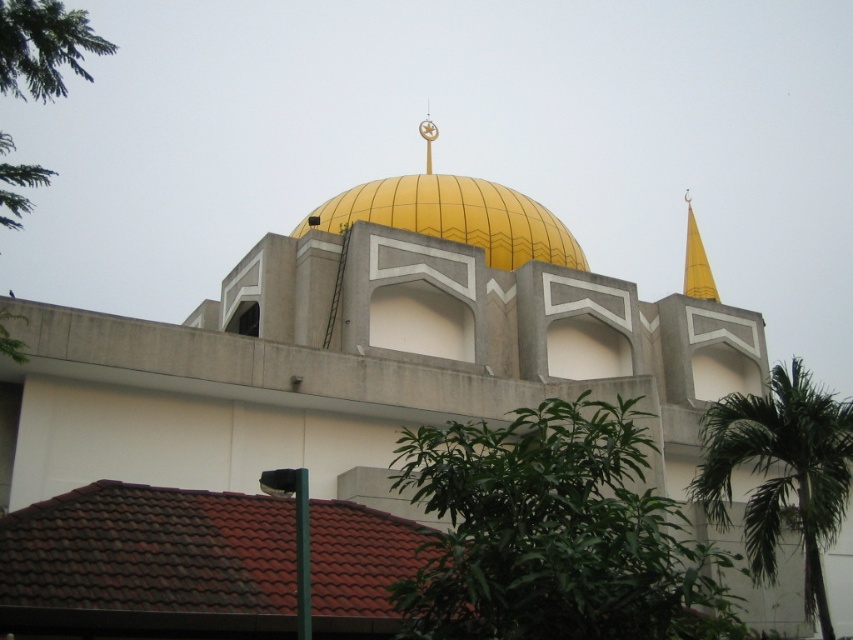
Question: Which point is closer to the camera?

Choices:
 (A) green leafy tree at left
 (B) yellow matte dome at center
 (C) green leafy palm at right
 (D) green leafy tree at lower center

Answer: (D)

Question: Observing the image, what is the correct spatial positioning of green leafy tree at lower center in reference to green leafy palm at right?

Choices:
 (A) right
 (B) left

Answer: (B)

Question: Among these objects, which one is farthest from the camera?

Choices:
 (A) green leafy tree at left
 (B) green leafy tree at lower center
 (C) yellow matte spire at upper center

Answer: (C)

Question: Is green leafy tree at lower center closer to camera compared to green leafy tree at left?

Choices:
 (A) yes
 (B) no

Answer: (A)

Question: Which point is closer to the camera?

Choices:
 (A) green leafy tree at lower center
 (B) yellow matte dome at center
 (C) yellow matte spire at upper center
 (D) gold metallic spire at upper center

Answer: (A)

Question: Can you confirm if green leafy tree at left is bigger than yellow matte spire at upper center?

Choices:
 (A) no
 (B) yes

Answer: (B)